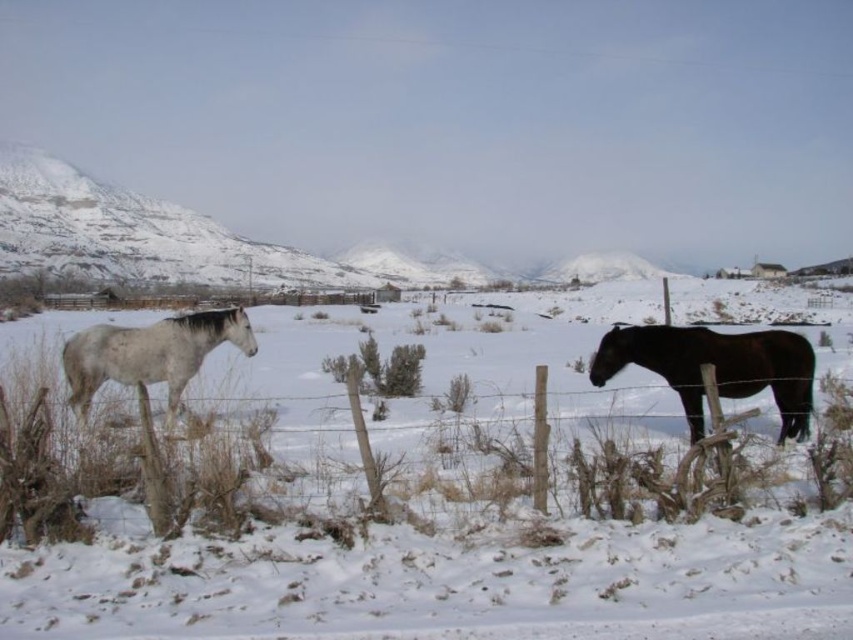
You are a photographer trying to capture the two points in the image. The first point is at coordinate point (322,545) and the second is at point (135,330). Which point is closer to the camera?

Point (322,545) is in front of point (135,330), so it is closer to the camera.